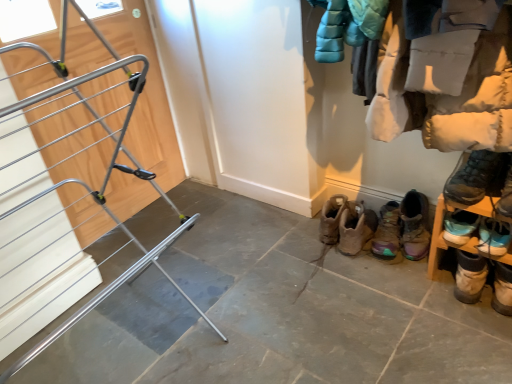
Find the location of `free space to the left of wooden shoe rack at lower right`. free space to the left of wooden shoe rack at lower right is located at coordinates (409, 294).